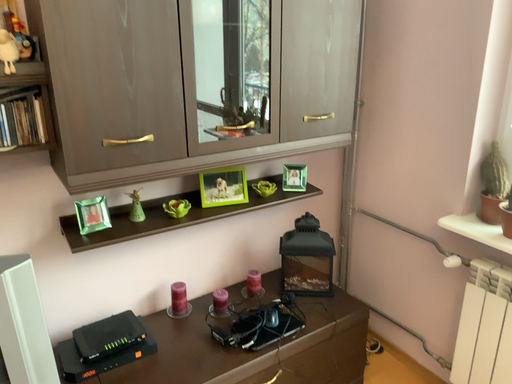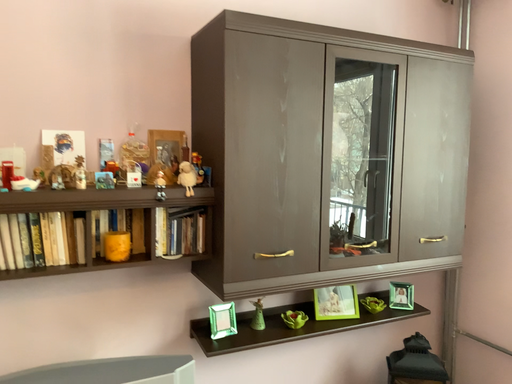
Question: Which way did the camera rotate in the video?

Choices:
 (A) rotated right
 (B) rotated left

Answer: (B)